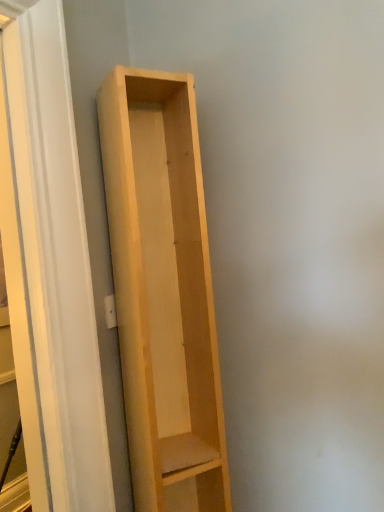
Question: Could you tell me if natural wood shelf at left is facing light wood shelf at center?

Choices:
 (A) yes
 (B) no

Answer: (B)

Question: From a real-world perspective, is natural wood shelf at left under light wood shelf at center?

Choices:
 (A) no
 (B) yes

Answer: (A)

Question: From a real-world perspective, is natural wood shelf at left over light wood shelf at center?

Choices:
 (A) no
 (B) yes

Answer: (B)

Question: Considering the relative sizes of natural wood shelf at left and light wood shelf at center in the image provided, is natural wood shelf at left thinner than light wood shelf at center?

Choices:
 (A) no
 (B) yes

Answer: (B)

Question: Is natural wood shelf at left with light wood shelf at center?

Choices:
 (A) yes
 (B) no

Answer: (B)

Question: Is natural wood shelf at left located outside light wood shelf at center?

Choices:
 (A) yes
 (B) no

Answer: (A)

Question: Is light wood shelf at center beside natural wood shelf at left?

Choices:
 (A) no
 (B) yes

Answer: (A)

Question: Does light wood shelf at center appear on the left side of natural wood shelf at left?

Choices:
 (A) no
 (B) yes

Answer: (A)

Question: Does light wood shelf at center have a lesser height compared to natural wood shelf at left?

Choices:
 (A) no
 (B) yes

Answer: (B)

Question: Would you say light wood shelf at center is a long distance from natural wood shelf at left?

Choices:
 (A) yes
 (B) no

Answer: (B)

Question: Is light wood shelf at center wider than natural wood shelf at left?

Choices:
 (A) yes
 (B) no

Answer: (A)

Question: Can natural wood shelf at left be found inside light wood shelf at center?

Choices:
 (A) no
 (B) yes

Answer: (A)

Question: From a real-world perspective, relative to natural wood shelf at left, is light wood shelf at center vertically above or below?

Choices:
 (A) above
 (B) below

Answer: (B)